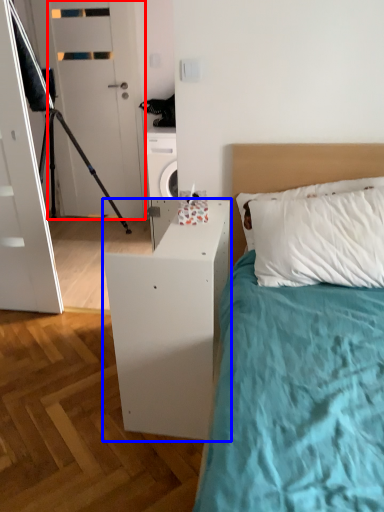
Question: Which object is closer to the camera taking this photo, door (highlighted by a red box) or nightstand (highlighted by a blue box)?

Choices:
 (A) door
 (B) nightstand

Answer: (B)